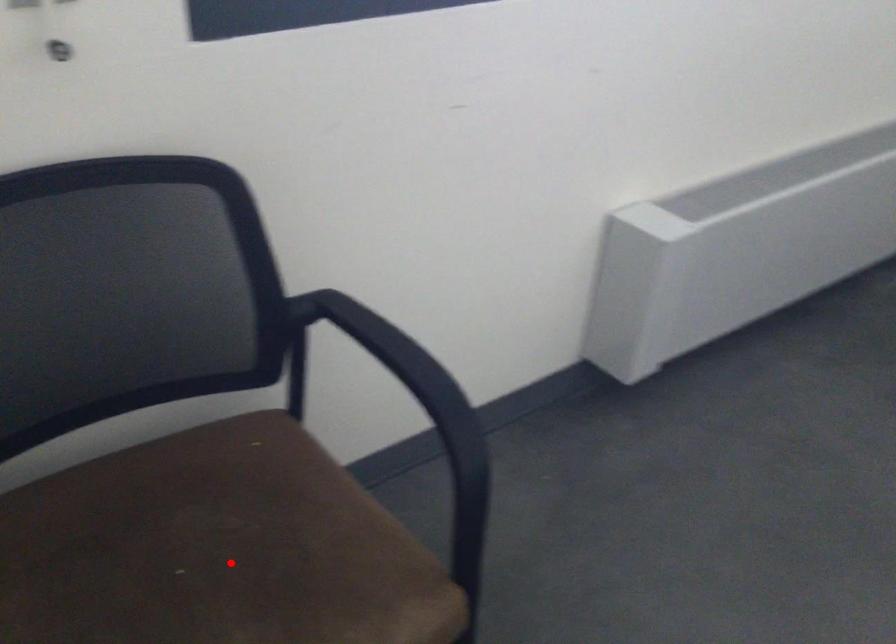
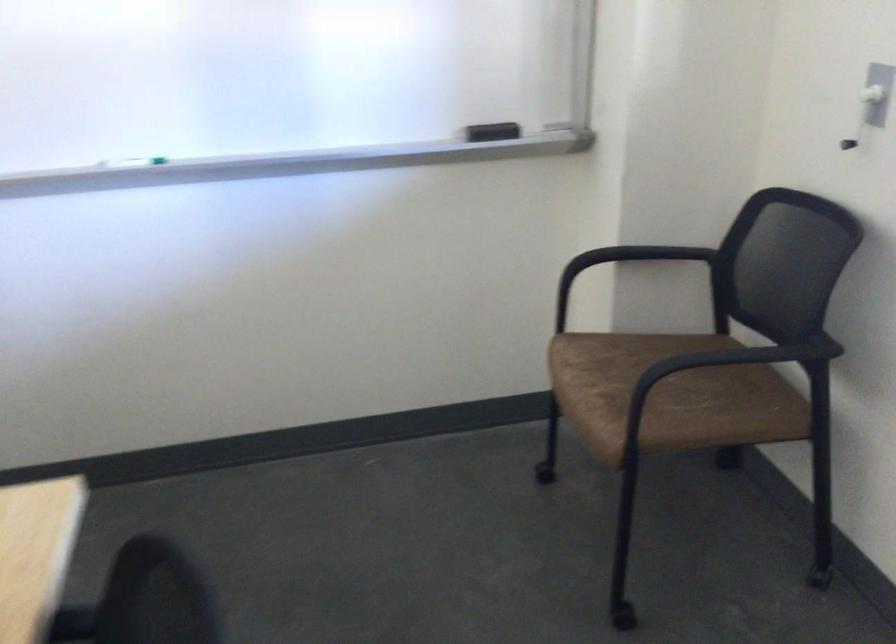
Question: I am providing you with two images of the same scene from different viewpoints. In image1, a red point is highlighted. Considering the same 3D point in image2, which of the following is correct?

Choices:
 (A) It is closer
 (B) It is farther

Answer: (B)